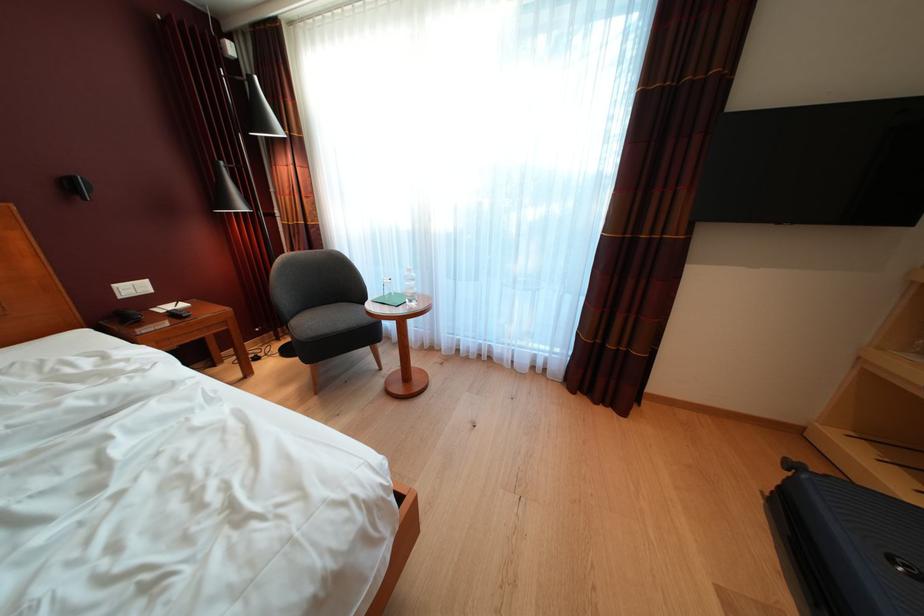
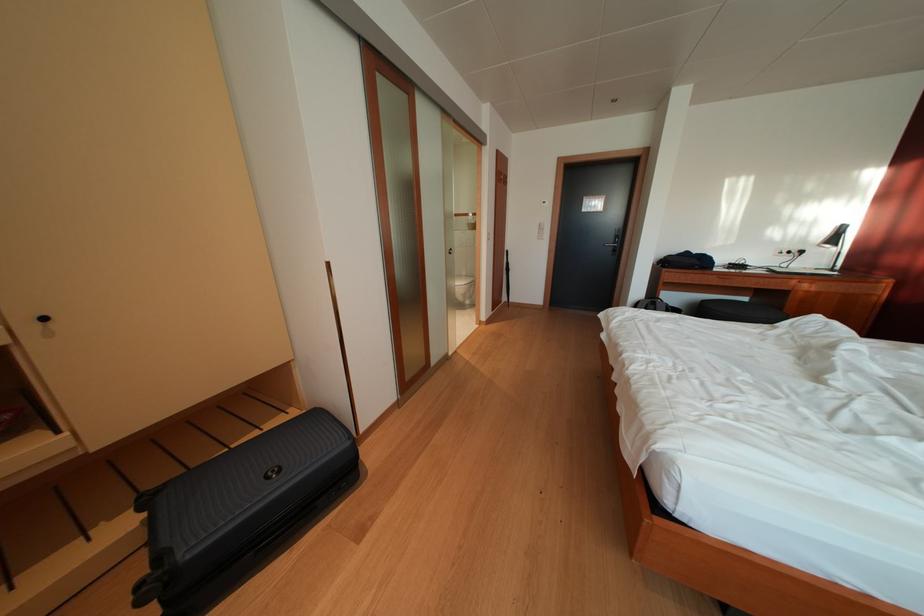
The point at (833, 482) is marked in the first image. Where is the corresponding point in the second image?

(167, 562)